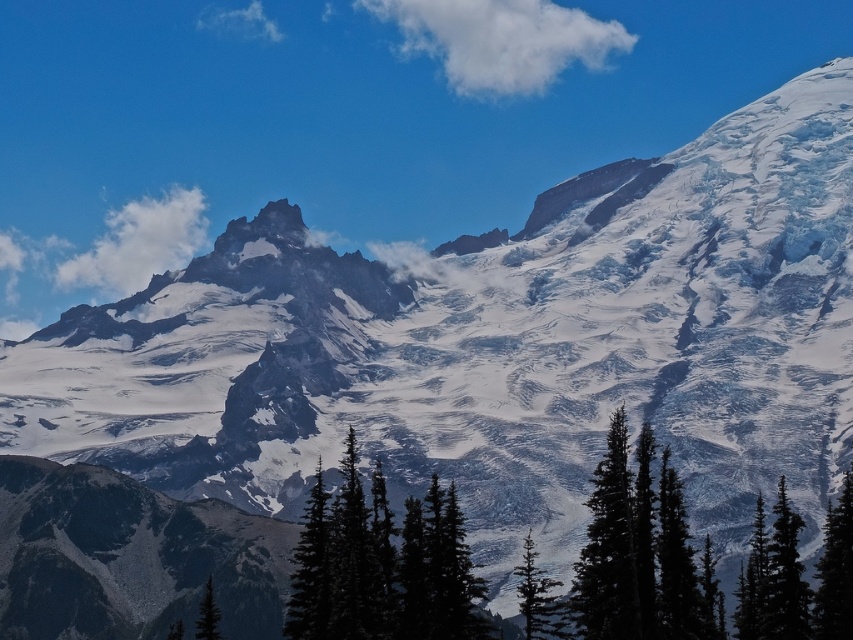
Is white fluffy cloud at upper left in front of green matte tree at lower left?

That is False.

Can you confirm if white fluffy cloud at upper left is positioned to the right of green matte tree at lower left?

In fact, white fluffy cloud at upper left is to the left of green matte tree at lower left.

Between point (192, 241) and point (212, 618), which one is positioned behind?

The point (192, 241) is behind.

This screenshot has width=853, height=640. In order to click on white fluffy cloud at upper left in this screenshot , I will do `click(138, 244)`.

Does white fluffy cloud at upper center have a smaller size compared to white fluffy cloud at upper left?

Correct, white fluffy cloud at upper center occupies less space than white fluffy cloud at upper left.

Which is more to the left, white fluffy cloud at upper center or white fluffy cloud at upper left?

Positioned to the left is white fluffy cloud at upper left.

Find the location of a particular element. white fluffy cloud at upper center is located at coordinates coord(502,40).

Does white fluffy cloud at upper left have a smaller size compared to green matte tree at lower right?

No.

This screenshot has height=640, width=853. What do you see at coordinates (138, 244) in the screenshot?
I see `white fluffy cloud at upper left` at bounding box center [138, 244].

Who is more forward, (x=206, y=205) or (x=850, y=627)?

Point (x=850, y=627) is more forward.

The height and width of the screenshot is (640, 853). Identify the location of white fluffy cloud at upper left. (138, 244).